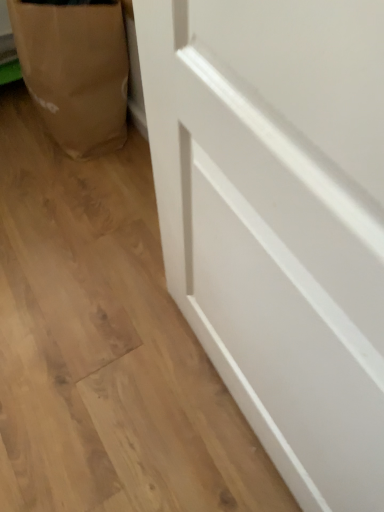
The width and height of the screenshot is (384, 512). Identify the location of white smooth door at lower right. (279, 220).

The width and height of the screenshot is (384, 512). Describe the element at coordinates (279, 220) in the screenshot. I see `white smooth door at lower right` at that location.

The image size is (384, 512). Describe the element at coordinates (75, 71) in the screenshot. I see `brown paper bag at lower left` at that location.

Locate an element on the screen. The height and width of the screenshot is (512, 384). brown paper bag at lower left is located at coordinates coord(75,71).

Measure the distance between point (107,54) and camera.

The depth of point (107,54) is 4.25 feet.

Where is `white smooth door at lower right`? The width and height of the screenshot is (384, 512). white smooth door at lower right is located at coordinates (279, 220).

Considering the positions of objects white smooth door at lower right and brown paper bag at lower left in the image provided, who is more to the left, white smooth door at lower right or brown paper bag at lower left?

brown paper bag at lower left.

Based on the photo, is white smooth door at lower right further to the viewer compared to brown paper bag at lower left?

No, white smooth door at lower right is closer to the camera.

Is point (370, 490) closer to viewer compared to point (38, 4)?

That is True.

From the image's perspective, is white smooth door at lower right located beneath brown paper bag at lower left?

Indeed, from the image's perspective, white smooth door at lower right is shown beneath brown paper bag at lower left.

In the scene shown: From a real-world perspective, relative to brown paper bag at lower left, is white smooth door at lower right vertically above or below?

From a real-world perspective, white smooth door at lower right is physically below brown paper bag at lower left.

Between white smooth door at lower right and brown paper bag at lower left, which one has smaller width?

With smaller width is brown paper bag at lower left.

Does white smooth door at lower right have a lesser height compared to brown paper bag at lower left?

Correct, white smooth door at lower right is not as tall as brown paper bag at lower left.

Does white smooth door at lower right have a larger size compared to brown paper bag at lower left?

Actually, white smooth door at lower right might be smaller than brown paper bag at lower left.

Which is correct: white smooth door at lower right is inside brown paper bag at lower left, or outside of it?

white smooth door at lower right is spatially situated outside brown paper bag at lower left.

Are white smooth door at lower right and brown paper bag at lower left located far from each other?

No, white smooth door at lower right is in close proximity to brown paper bag at lower left.

Could you tell me if white smooth door at lower right is facing brown paper bag at lower left?

No, white smooth door at lower right is not aimed at brown paper bag at lower left.

How different are the orientations of white smooth door at lower right and brown paper bag at lower left in degrees?

The facing directions of white smooth door at lower right and brown paper bag at lower left are 91.2 degrees apart.

At what (x,y) coordinates should I click in order to perform the action: click on door below the brown paper bag at lower left (from the image's perspective). Please return your answer as a coordinate pair (x, y). The width and height of the screenshot is (384, 512). Looking at the image, I should click on (279, 220).

Does brown paper bag at lower left appear on the right side of white smooth door at lower right?

No, brown paper bag at lower left is not to the right of white smooth door at lower right.

Which object is further away from the camera, brown paper bag at lower left or white smooth door at lower right?

Positioned behind is brown paper bag at lower left.

Does point (70, 136) appear closer or farther from the camera than point (261, 101)?

Point (70, 136) is farther from the camera than point (261, 101).

From the image's perspective, between brown paper bag at lower left and white smooth door at lower right, which one is located above?

brown paper bag at lower left is shown above in the image.

From a real-world perspective, does brown paper bag at lower left stand above white smooth door at lower right?

Correct, in the physical world, brown paper bag at lower left is higher than white smooth door at lower right.

Is brown paper bag at lower left thinner than white smooth door at lower right?

Yes.

Does brown paper bag at lower left have a lesser height compared to white smooth door at lower right?

In fact, brown paper bag at lower left may be taller than white smooth door at lower right.

Which of these two, brown paper bag at lower left or white smooth door at lower right, is bigger?

Bigger between the two is brown paper bag at lower left.

Is brown paper bag at lower left inside the boundaries of white smooth door at lower right, or outside?

brown paper bag at lower left is spatially situated outside white smooth door at lower right.

Is brown paper bag at lower left next to white smooth door at lower right?

brown paper bag at lower left and white smooth door at lower right are not in contact.

Is brown paper bag at lower left oriented towards white smooth door at lower right?

No, brown paper bag at lower left is not turned towards white smooth door at lower right.

How distant is brown paper bag at lower left from white smooth door at lower right?

The distance of brown paper bag at lower left from white smooth door at lower right is 33.84 inches.

Locate an element on the screen. The height and width of the screenshot is (512, 384). door that is under the brown paper bag at lower left (from a real-world perspective) is located at coordinates coord(279,220).

The width and height of the screenshot is (384, 512). Find the location of `door lying in front of the brown paper bag at lower left`. door lying in front of the brown paper bag at lower left is located at coordinates (279, 220).

Where is `paper bag behind the white smooth door at lower right`? paper bag behind the white smooth door at lower right is located at coordinates (75, 71).